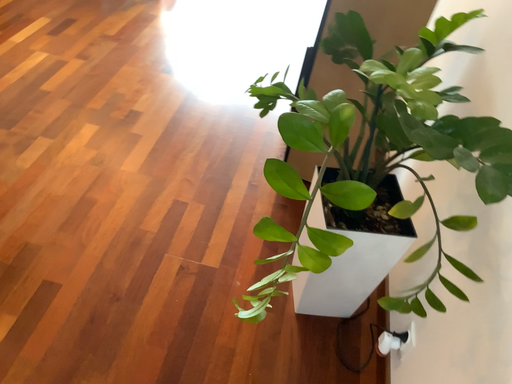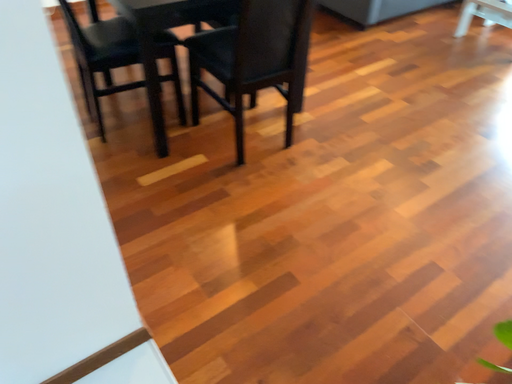
Question: How did the camera likely rotate when shooting the video?

Choices:
 (A) rotated right
 (B) rotated left

Answer: (B)